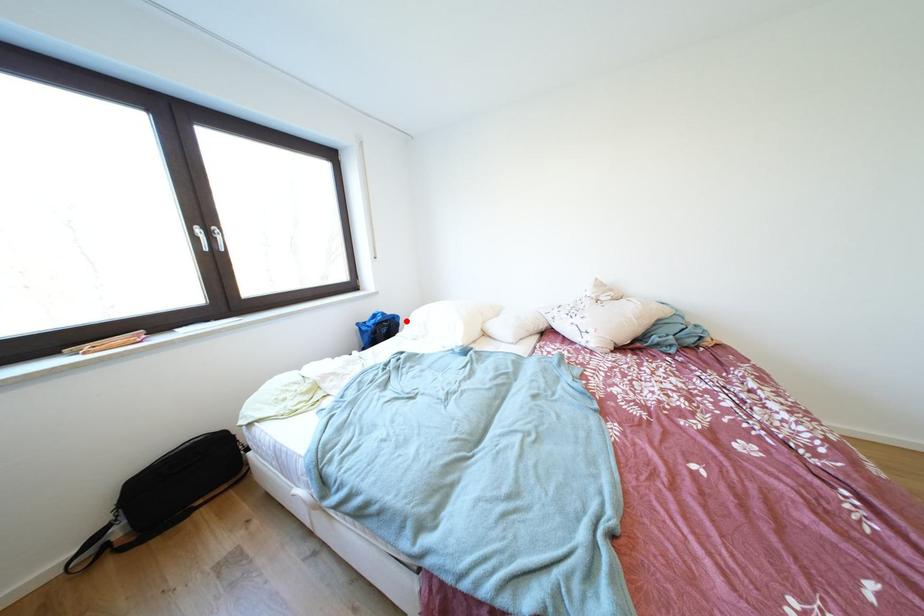
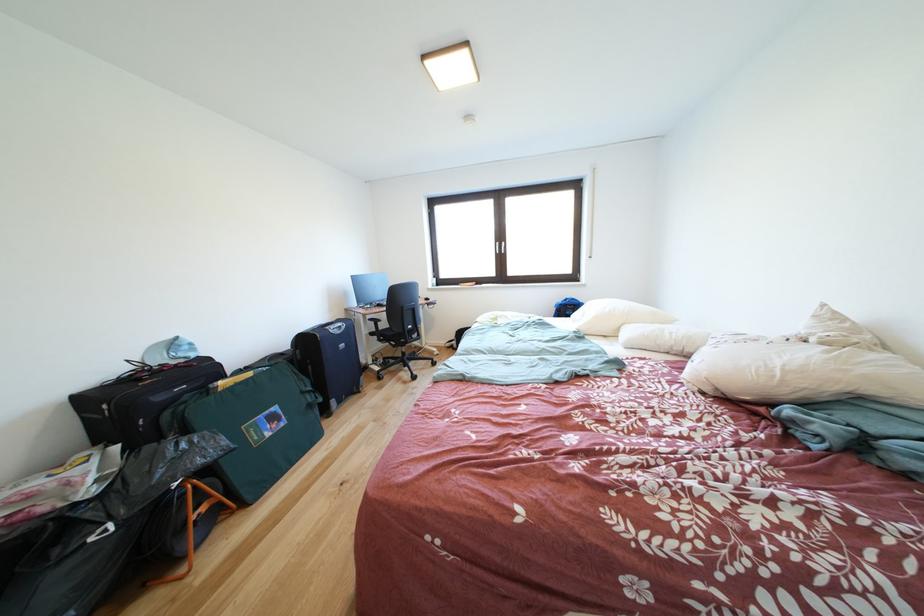
Question: I am providing you with two images of the same scene from different viewpoints. A red point is marked on the first image. At the location where the point appears in image 1, is it still visible in image 2?

Choices:
 (A) Yes
 (B) No

Answer: (A)